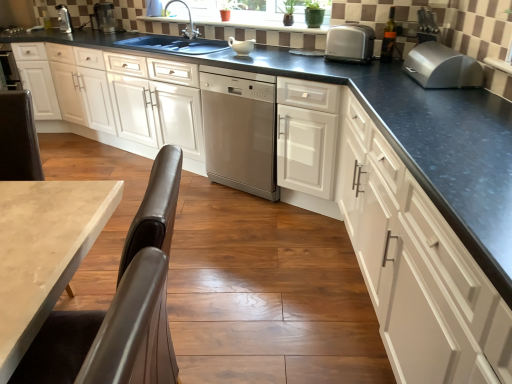
Where is `free space on the front side of satin silver toaster at upper right, positioned as the 2th kitchen appliance in bottom-to-top order`? The width and height of the screenshot is (512, 384). free space on the front side of satin silver toaster at upper right, positioned as the 2th kitchen appliance in bottom-to-top order is located at coordinates (345, 71).